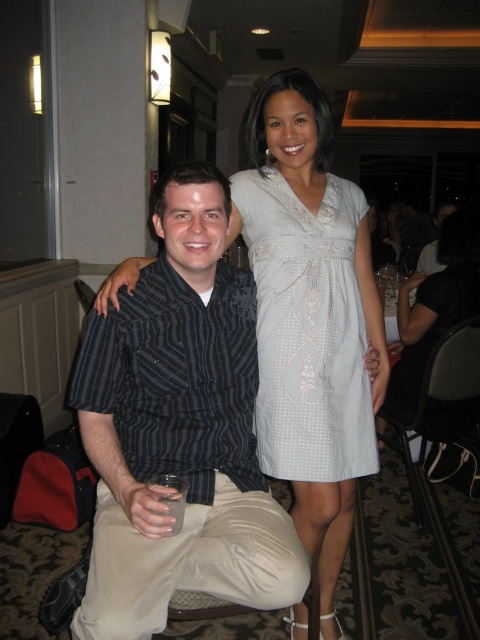
Question: Does light blue fabric dress at center appear on the right side of white lace dress at center?

Choices:
 (A) no
 (B) yes

Answer: (A)

Question: Which of the following is the farthest from the observer?

Choices:
 (A) (313, 262)
 (B) (431, 314)
 (C) (227, 376)

Answer: (B)

Question: Which point is farther from the camera taking this photo?

Choices:
 (A) (156, 380)
 (B) (299, 285)
 (C) (421, 348)

Answer: (C)

Question: Which object is farther from the camera taking this photo?

Choices:
 (A) striped cotton shirt at left
 (B) light blue fabric dress at center

Answer: (B)

Question: Does light blue fabric dress at center appear on the right side of white lace dress at center?

Choices:
 (A) no
 (B) yes

Answer: (A)

Question: Does striped cotton shirt at left appear on the right side of light blue fabric dress at center?

Choices:
 (A) no
 (B) yes

Answer: (A)